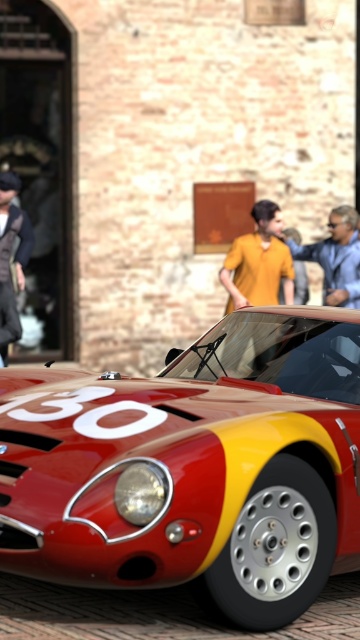
You are a photographer planning to take a portrait of someone wearing the yellow matte shirt at center in front of the vintage sports car. Based on the car and shirt positions, where should the person stand to ensure the shirt is centered in the frame while the car remains the main subject?

The person should stand directly in front of the vintage sports car, aligning the yellow matte shirt at center with the car to keep it centered while ensuring the car remains the primary focus.

You are a photographer trying to capture the shiny red and yellow sports car at center and the matte yellow shirt at center in a single frame. Based on their sizes, which object should you focus on to ensure both fit in the photo without cropping?

The shiny red and yellow sports car at center might be wider than matte yellow shirt at center, so focusing on the car would ensure both fit in the frame without cropping.

You are a photographer standing 3 meters away from the shiny red and yellow sports car at center. You want to take a photo of the yellow matte shirt at center without the car blocking the view. Is the distance between the car and the shirt sufficient for you to step back and still capture the shirt clearly in the frame?

The distance between the shiny red and yellow sports car at center and the yellow matte shirt at center is 5.34 meters. Since you are already 3 meters away from the car, stepping back would place you 8.34 meters from the car and 3 meters from the shirt. However, the 5.34 meters between them allows enough space to position yourself behind the shirt, ensuring the car doesn